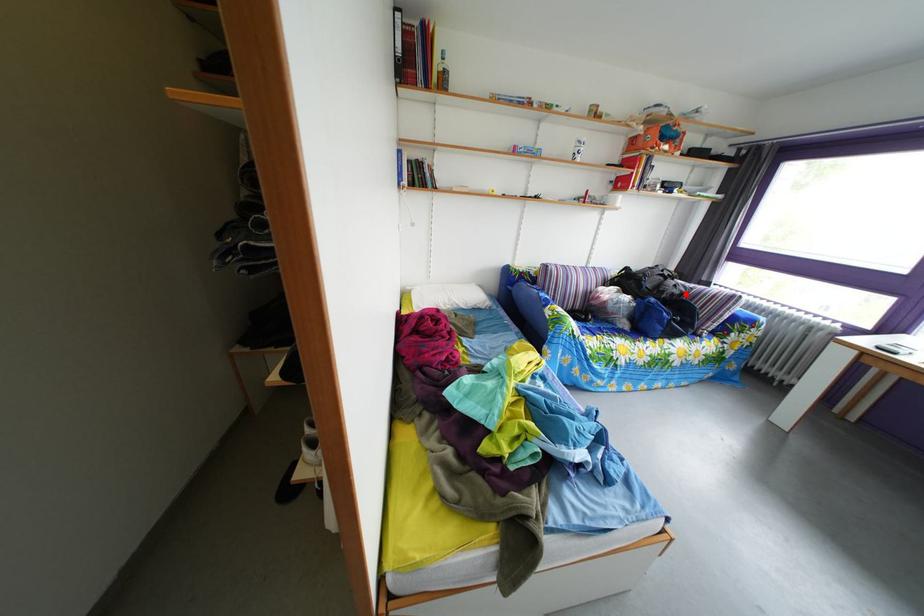
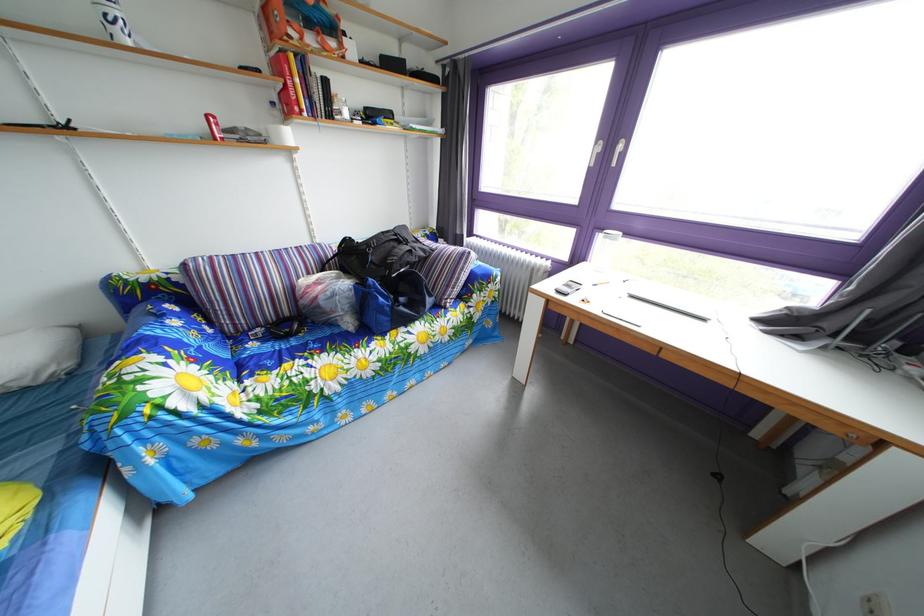
The point at the highlighted location is marked in the first image. Where is the corresponding point in the second image?

(421, 260)